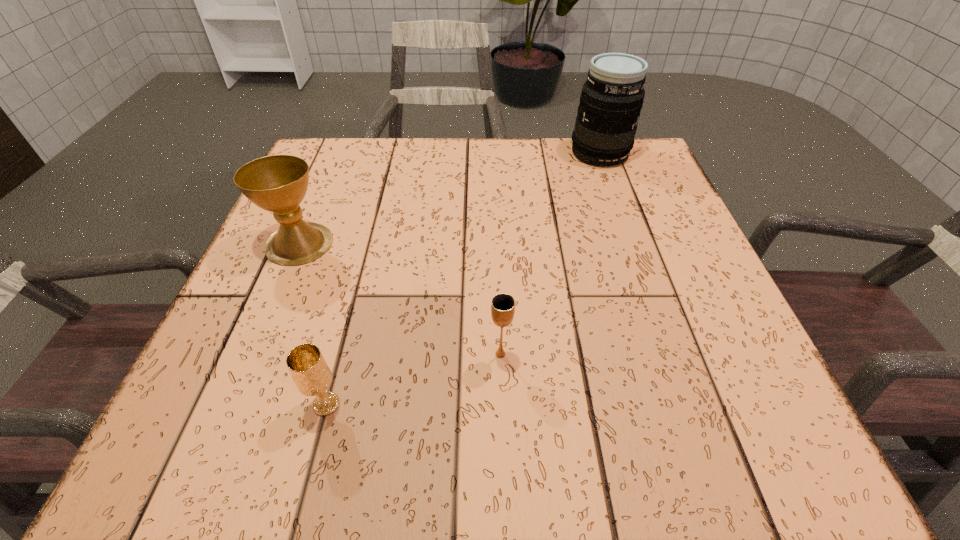
This screenshot has height=540, width=960. What are the coordinates of `vacant area that satisfies the following two spatial constraints: 1. on the back side of the nearest chalice; 2. on the right side of the rightmost object` in the screenshot? It's located at pyautogui.click(x=393, y=153).

At what (x,y) coordinates should I click in order to perform the action: click on free point that satisfies the following two spatial constraints: 1. on the back side of the third object from left to right; 2. on the left side of the farthest object. Please return your answer as a coordinate pair (x, y). This screenshot has width=960, height=540. Looking at the image, I should click on (492, 153).